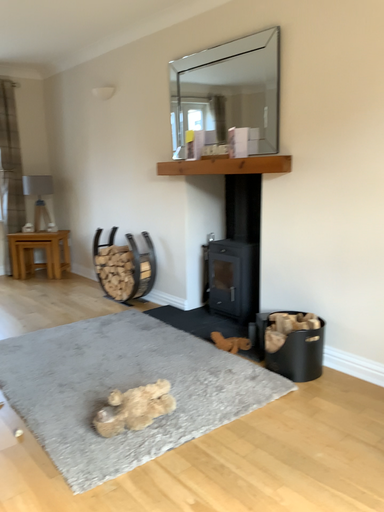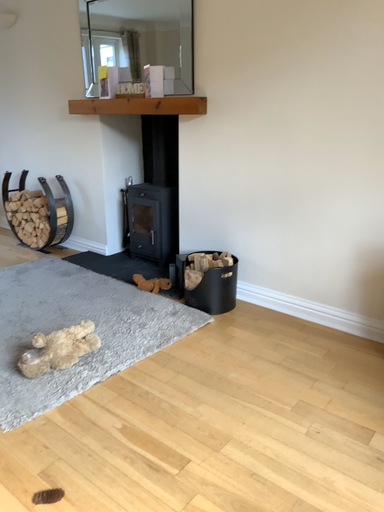
Question: Which way did the camera rotate in the video?

Choices:
 (A) rotated right
 (B) rotated left

Answer: (A)